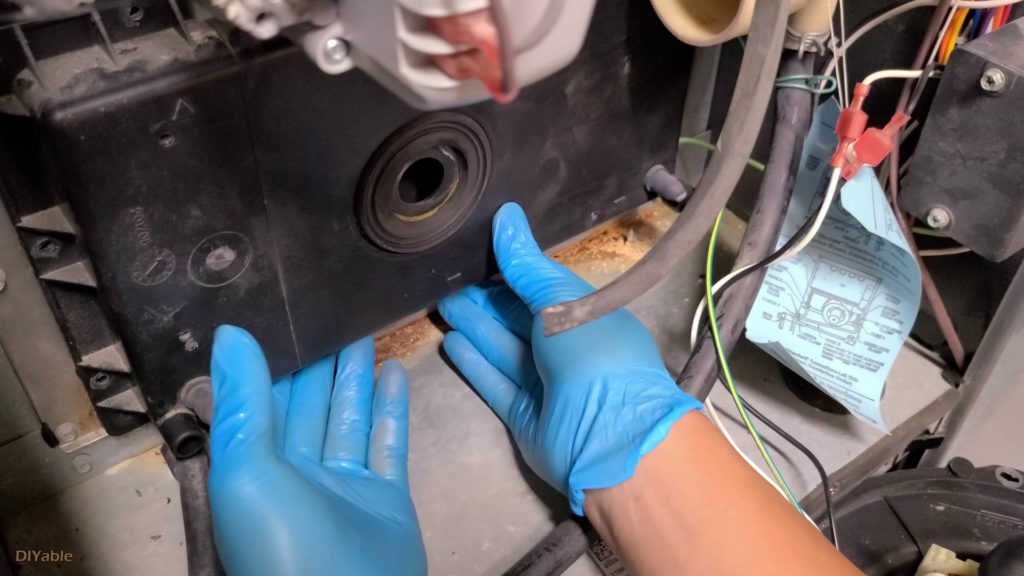
Where is `shelf`? Image resolution: width=1024 pixels, height=576 pixels. shelf is located at coordinates [x=463, y=484].